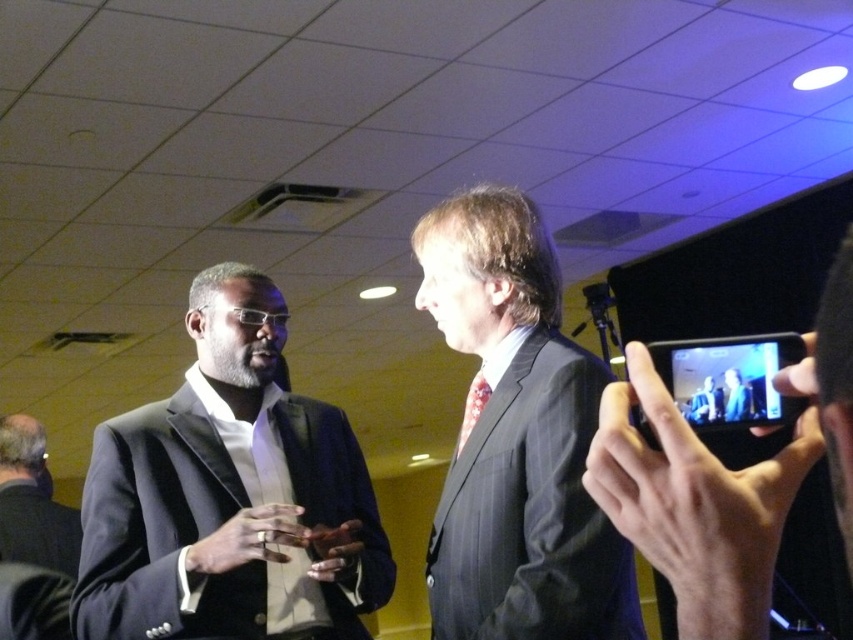
Between point (711, 419) and point (474, 406), which one is positioned in front?

Point (711, 419)

Is matte black suit at center positioned behind patterned silk tie at center?

No, matte black suit at center is in front of patterned silk tie at center.

Is point (697, 417) positioned in front of point (490, 394)?

Yes.

This screenshot has height=640, width=853. I want to click on matte black suit at center, so click(x=704, y=403).

Who is taller, dark gray pinstripe suit at center or patterned silk tie at center?

With more height is dark gray pinstripe suit at center.

Who is more distant from viewer, (x=430, y=212) or (x=471, y=426)?

The point (x=430, y=212) is behind.

Is point (505, 582) closer to camera compared to point (482, 380)?

Yes, it is in front of point (482, 380).

This screenshot has width=853, height=640. What are the coordinates of `dark gray pinstripe suit at center` in the screenshot? It's located at click(x=517, y=440).

Can you confirm if dark gray pinstripe suit at center is positioned to the right of matte black suit at center?

No, dark gray pinstripe suit at center is not to the right of matte black suit at center.

Which is behind, point (520, 230) or point (691, 422)?

Positioned behind is point (520, 230).

Find the location of a particular element. The height and width of the screenshot is (640, 853). dark gray pinstripe suit at center is located at coordinates (517, 440).